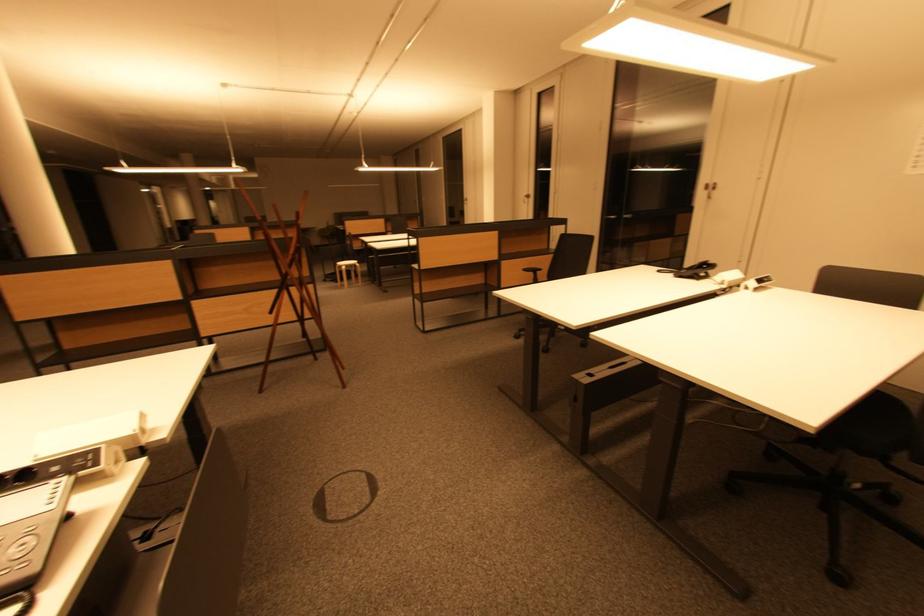
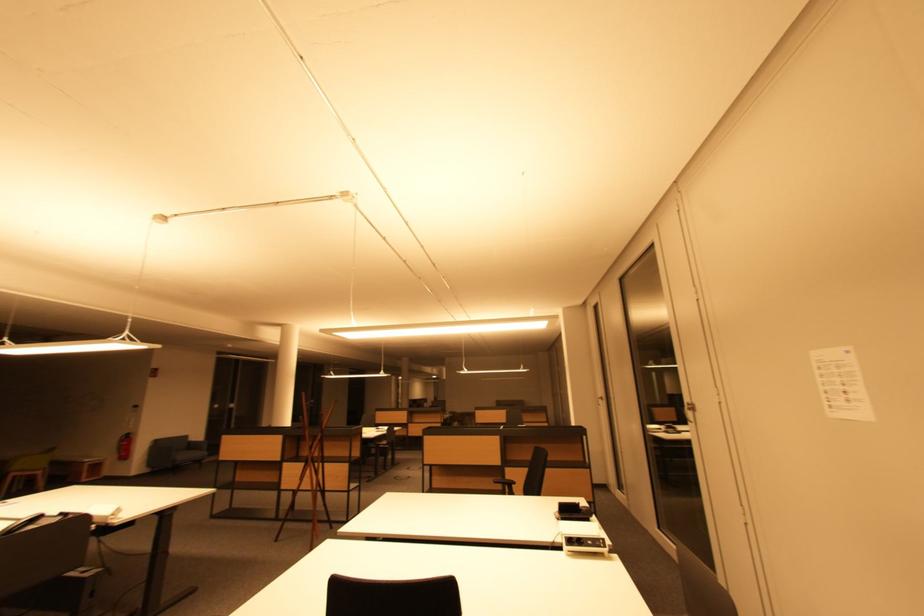
Find the pixel in the second image that matches point 531,198 in the first image.

(605, 400)